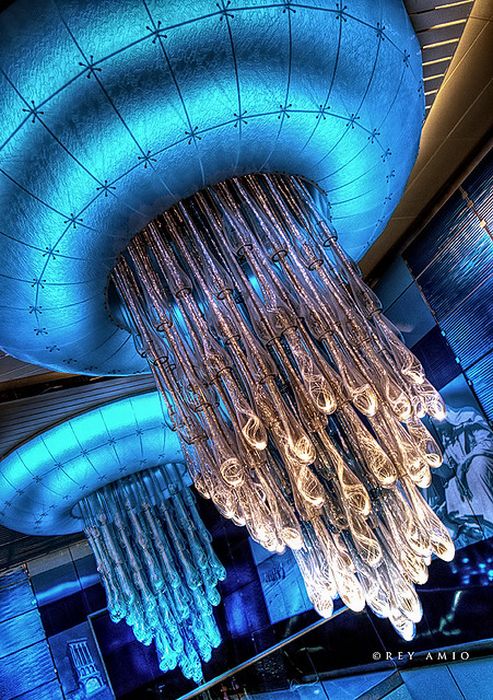
This screenshot has height=700, width=493. I want to click on painting, so click(x=83, y=657), click(x=480, y=484).